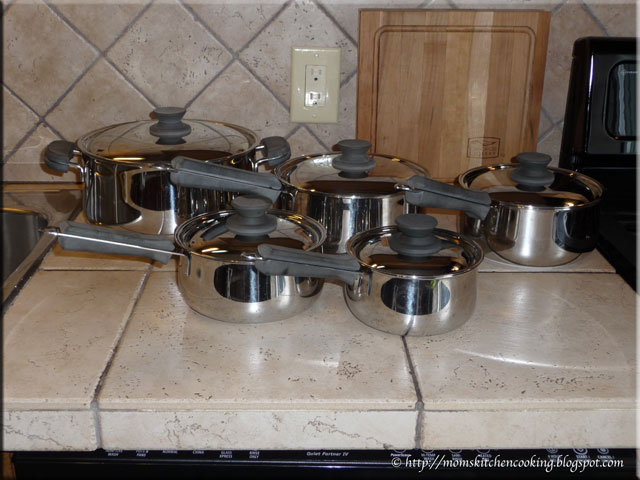
The width and height of the screenshot is (640, 480). I want to click on pot, so (114, 199).